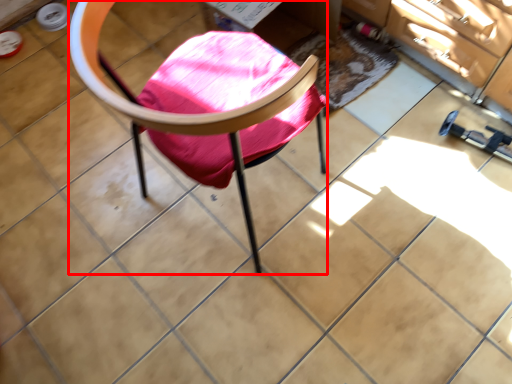
Question: From the image, what is the correct spatial relationship of chair (annotated by the red box) in relation to mat?

Choices:
 (A) right
 (B) left

Answer: (B)